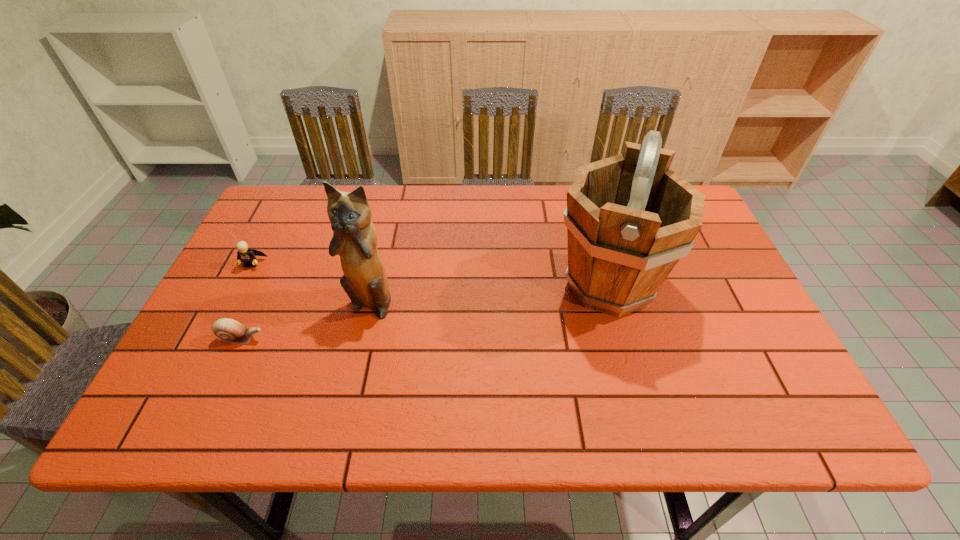
This screenshot has width=960, height=540. I want to click on empty space between the second tallest object and the Lego, so click(x=311, y=282).

This screenshot has height=540, width=960. Identify the location of free spot between the Lego and the escargot. (247, 301).

Where is `vacant region between the Lego and the rightmost object`? This screenshot has width=960, height=540. vacant region between the Lego and the rightmost object is located at coordinates (430, 275).

This screenshot has width=960, height=540. I want to click on unoccupied area between the cat and the escargot, so click(306, 320).

Where is `free space between the shortest object and the tallest object`? The width and height of the screenshot is (960, 540). free space between the shortest object and the tallest object is located at coordinates tap(425, 312).

The width and height of the screenshot is (960, 540). Find the location of `free space between the shortest object and the cat`. free space between the shortest object and the cat is located at coordinates (306, 320).

The height and width of the screenshot is (540, 960). I want to click on vacant region between the shortest object and the third tallest object, so click(x=247, y=301).

Find the location of a particular element. object that stands as the closest to the shortest object is located at coordinates (354, 239).

At what (x,y) coordinates should I click in order to perform the action: click on the second closest object to the escargot. Please return your answer as a coordinate pair (x, y). Image resolution: width=960 pixels, height=540 pixels. Looking at the image, I should click on (248, 256).

Find the location of `vacant space that satisfies the following two spatial constraints: 1. on the front-facing side of the tallest object; 2. on the right side of the second shortest object`. vacant space that satisfies the following two spatial constraints: 1. on the front-facing side of the tallest object; 2. on the right side of the second shortest object is located at coordinates pos(241,286).